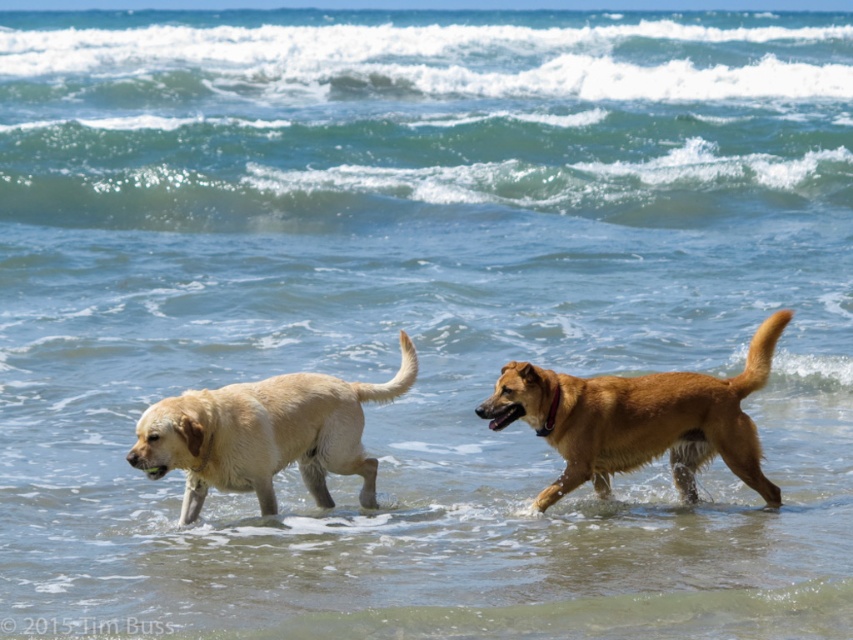
You are a photographer trying to capture both the brown furry dog at center and the light brown fur dog at left in a single shot. Given that your camera has a fixed focus range, which dog would you need to adjust your focus settings for to ensure it appears sharp in the photo?

The light brown fur dog at left is larger in size compared to the brown furry dog at center, so you should adjust the focus settings for the light brown fur dog at left to ensure it appears sharp in the photo.

From the picture: You are a drone operator trying to capture a photo of both the brown furry dog at center and the light brown fur dog at left. The minimum distance between the dogs required for the photo to include both in frame is 1.2 meters. Based on the scene, will the photo successfully include both dogs?

The distance between the brown furry dog at center and the light brown fur dog at left is 1.17 meters, which is less than the required 1.2 meters. Therefore, the photo will successfully include both dogs in the frame.

You are a photographer standing at the beach. You want to take a photo of both the brown furry dog at center and the light brown fur dog at left. Based on their positions, which dog should you focus on first to ensure both are in the frame?

The light brown fur dog at left is behind the brown furry dog at center, so you should focus on the brown furry dog at center first to ensure it doesn not block the other dog in the photo.